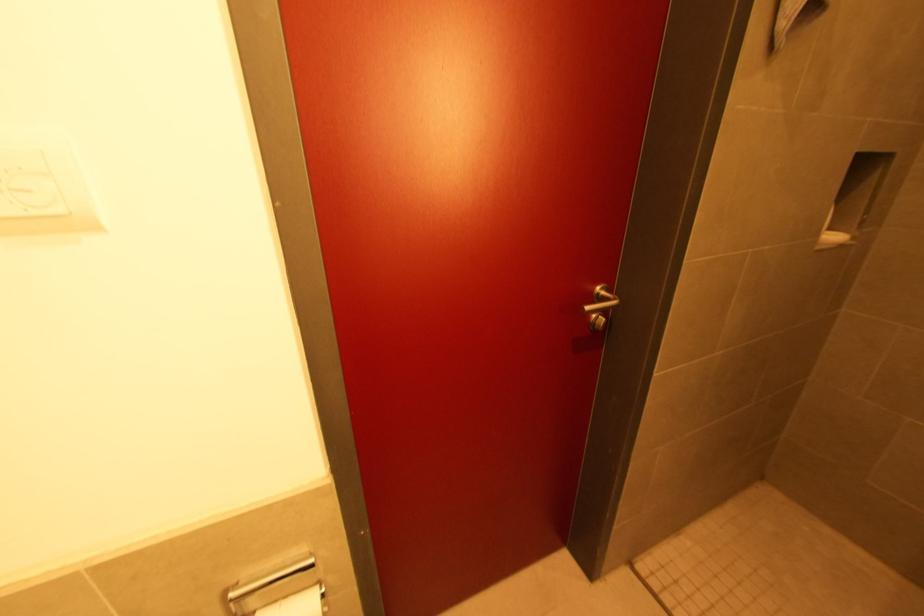
Where would you pull the silver door handle? Please return your answer as a coordinate pair (x, y).

(600, 307)